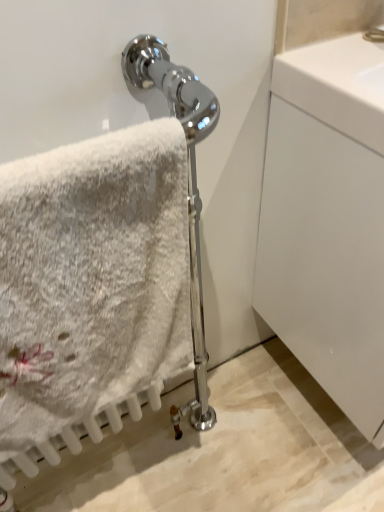
Question: From a real-world perspective, is white fluffy towel at left physically located above or below white glossy cabinet at right?

Choices:
 (A) above
 (B) below

Answer: (A)

Question: Considering the positions of point (51, 373) and point (289, 205), is point (51, 373) closer or farther from the camera than point (289, 205)?

Choices:
 (A) farther
 (B) closer

Answer: (B)

Question: Is white fluffy towel at left inside or outside of white glossy cabinet at right?

Choices:
 (A) inside
 (B) outside

Answer: (B)

Question: Is white glossy cabinet at right to the left or to the right of white fluffy towel at left in the image?

Choices:
 (A) left
 (B) right

Answer: (B)

Question: Considering the positions of white glossy cabinet at right and white fluffy towel at left in the image, is white glossy cabinet at right taller or shorter than white fluffy towel at left?

Choices:
 (A) tall
 (B) short

Answer: (A)

Question: From the image's perspective, is white glossy cabinet at right positioned above or below white fluffy towel at left?

Choices:
 (A) above
 (B) below

Answer: (A)

Question: Is white glossy cabinet at right in front of or behind white fluffy towel at left in the image?

Choices:
 (A) front
 (B) behind

Answer: (B)